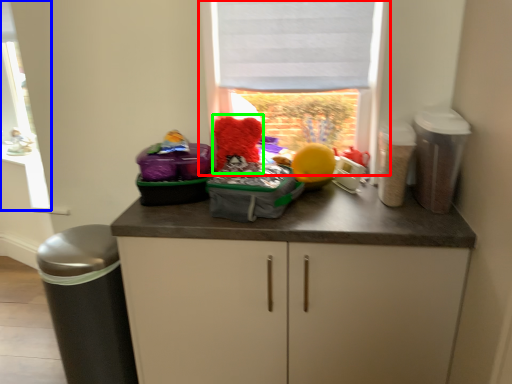
Question: Which object is the farthest from window (highlighted by a red box)? Choose among these: window frame (highlighted by a blue box) or teddy (highlighted by a green box).

Choices:
 (A) window frame
 (B) teddy

Answer: (A)